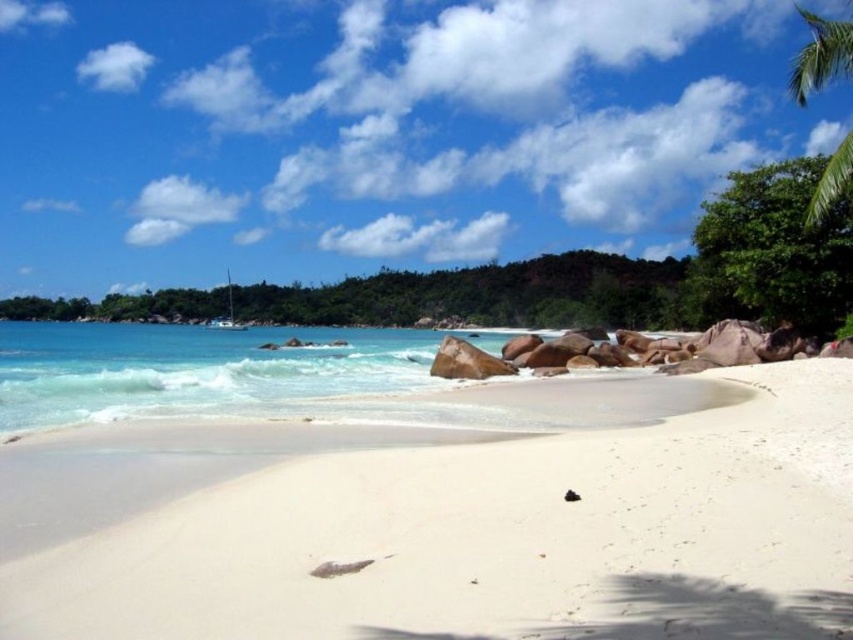
You are standing on the white sandy beach at center and want to take a photo of the green leafy palm tree at upper right. Which object will appear larger in your camera viewfinder?

The green leafy palm tree at upper right will appear larger in the camera viewfinder because it is larger than the white sandy beach at center.